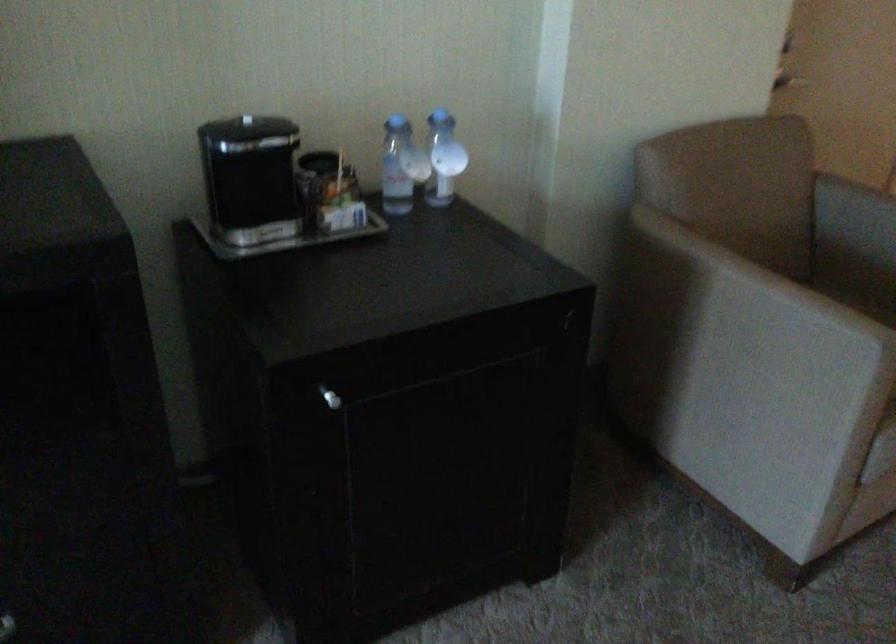
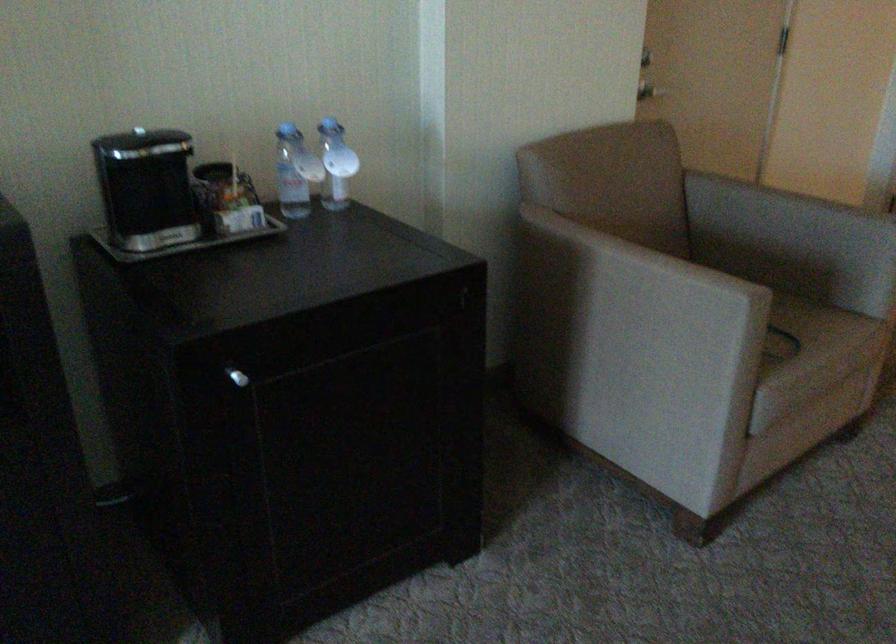
Where in the second image is the point corresponding to pixel 253 185 from the first image?

(149, 194)